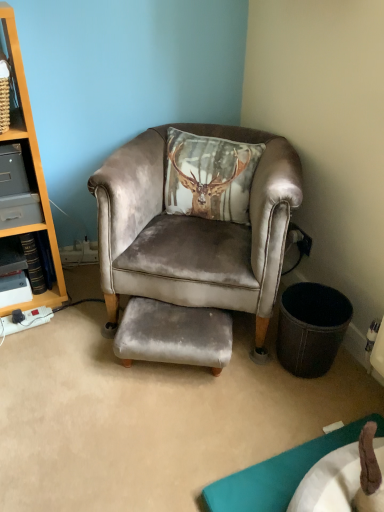
Find the location of a particular element. The image size is (384, 512). free space on the front side of velvet grey footrest at center is located at coordinates pos(177,421).